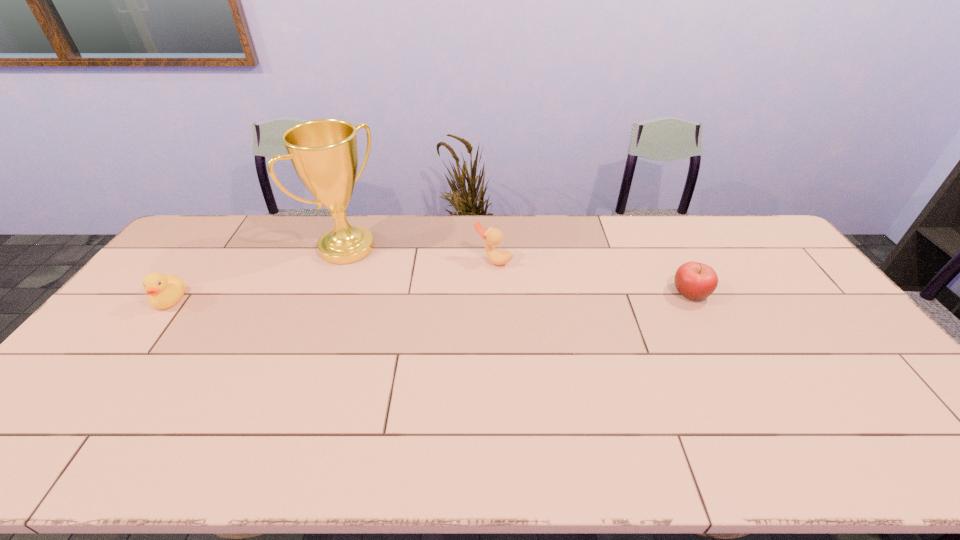
You are a GUI agent. You are given a task and a screenshot of the screen. Output one action in this format:
    pyautogui.click(x=<x>, y=<y>)
    Task: Click on the vacant space located by the handles of the tallest object
    
    Given the screenshot: What is the action you would take?
    pyautogui.click(x=449, y=315)

The width and height of the screenshot is (960, 540). In order to click on free space located by the handles of the tallest object in this screenshot , I will do `click(418, 295)`.

Locate an element on the screen. This screenshot has height=540, width=960. vacant space positioned 0.280m by the handles of the tallest object is located at coordinates coord(427,301).

At what (x,y) coordinates should I click in order to perform the action: click on duck that is at the far edge. Please return your answer as a coordinate pair (x, y). The image size is (960, 540). Looking at the image, I should click on (492, 236).

Find the location of a particular element. This screenshot has width=960, height=540. award located in the far edge section of the desktop is located at coordinates (324, 153).

I want to click on object situated at the left edge, so click(164, 291).

Identify the location of vacant region at the far edge of the desktop. The height and width of the screenshot is (540, 960). (687, 250).

In the image, there is a desktop. Where is `vacant space at the near edge`? The height and width of the screenshot is (540, 960). vacant space at the near edge is located at coordinates (523, 392).

Locate an element on the screen. free region at the left edge of the desktop is located at coordinates (145, 333).

Where is `vacant area at the right edge`? vacant area at the right edge is located at coordinates (807, 307).